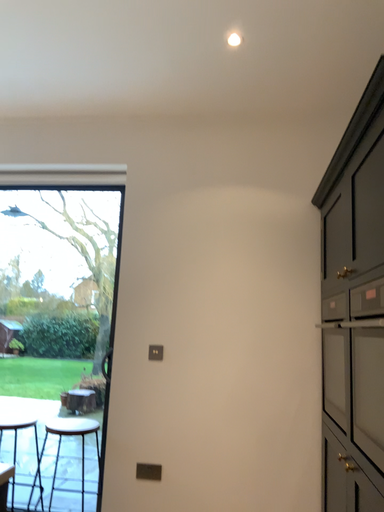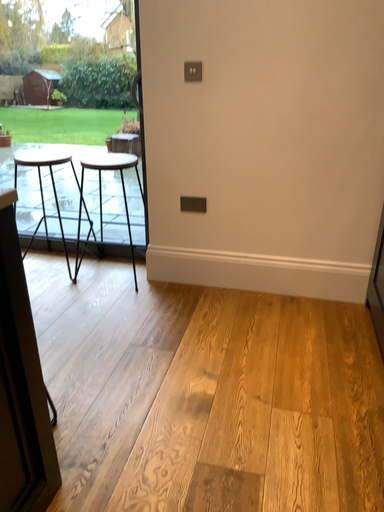
Question: How did the camera likely rotate when shooting the video?

Choices:
 (A) rotated upward
 (B) rotated downward

Answer: (B)